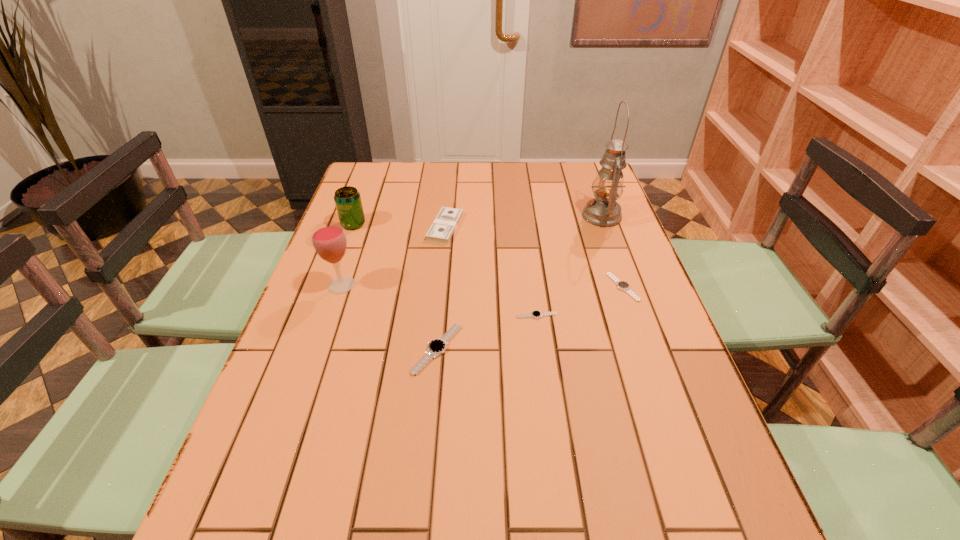
Identify the location of free space located 0.180m on the right of the nearest watch. The height and width of the screenshot is (540, 960). (540, 349).

Find the location of a particular element. vacant region located 0.190m on the front of the third object from right to left is located at coordinates (545, 386).

Where is `vacant space located on the front of the second tallest watch`? The height and width of the screenshot is (540, 960). vacant space located on the front of the second tallest watch is located at coordinates (654, 374).

Where is `vacant space located on the front of the tallest object`? The image size is (960, 540). vacant space located on the front of the tallest object is located at coordinates (628, 287).

Image resolution: width=960 pixels, height=540 pixels. What are the coordinates of `free region located on the right of the fourth tallest object` in the screenshot? It's located at (482, 227).

Identify the location of blank space located on the back of the fifth shortest object. This screenshot has width=960, height=540. (371, 176).

What are the coordinates of `free location located on the front of the sixth shortest object` in the screenshot? It's located at (318, 355).

In order to click on beer can located in the left edge section of the desktop in this screenshot , I will do `click(347, 199)`.

What are the coordinates of `wineglass that is at the left edge` in the screenshot? It's located at (329, 240).

Image resolution: width=960 pixels, height=540 pixels. In order to click on watch positioned at the right edge in this screenshot , I will do `click(622, 285)`.